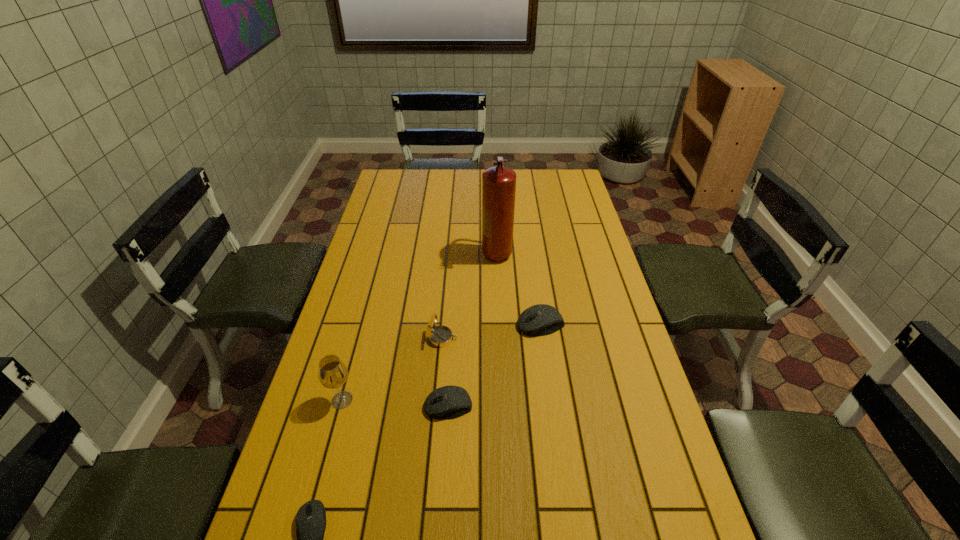
Find the location of `vacant space situated on the handle side the farthest object`. vacant space situated on the handle side the farthest object is located at coordinates (501, 355).

Find the location of a particular element. The image size is (960, 540). free space located 0.340m with the dial facing the fourth shortest object is located at coordinates (571, 338).

In order to click on free spot located on the front of the fifth shortest object in this screenshot , I will do `click(306, 531)`.

Identify the location of object at the left edge. The width and height of the screenshot is (960, 540). [x=332, y=373].

Identify the location of vacant region at the far edge. The image size is (960, 540). (441, 174).

You are a GUI agent. You are given a task and a screenshot of the screen. Output one action in this format:
    pyautogui.click(x=<x>, y=<y>)
    Task: Click on the vacant space at the left edge
    The height and width of the screenshot is (540, 960).
    Given the screenshot: What is the action you would take?
    pyautogui.click(x=356, y=423)

Locate an element on the screen. vacant space at the right edge of the desktop is located at coordinates (588, 342).

Image resolution: width=960 pixels, height=540 pixels. Find the location of `free space at the far left corner of the desktop`. free space at the far left corner of the desktop is located at coordinates (385, 175).

At what (x,y) coordinates should I click in order to perform the action: click on vacant area that lies between the second computer equipment from right to left and the wineglass. Please return your answer as a coordinate pair (x, y). This screenshot has height=540, width=960. Looking at the image, I should click on (396, 403).

The height and width of the screenshot is (540, 960). Identify the location of vacant space in between the compass and the second computer equipment from right to left. (444, 372).